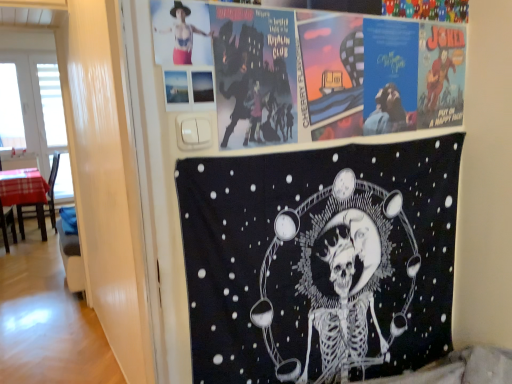
Question: In the image, is matte black and pink fabric at upper left on the left side or the right side of plaid fabric chair at left?

Choices:
 (A) left
 (B) right

Answer: (B)

Question: Is point (190, 1) positioned closer to the camera than point (30, 216)?

Choices:
 (A) closer
 (B) farther

Answer: (A)

Question: Based on their relative distances, which object is farther from the white plastic window screen at left?

Choices:
 (A) black fabric poster at upper center, which ranks as the first poster in bottom-to-top order
 (B) matte paper poster at upper center, positioned as the first poster in top-to-bottom order
 (C) matte black and pink fabric at upper left
 (D) plaid fabric chair at left

Answer: (C)

Question: Which object is the farthest from the white plastic window screen at left?

Choices:
 (A) plaid fabric chair at left
 (B) black fabric poster at upper center, which ranks as the first poster in bottom-to-top order
 (C) matte paper poster at upper center, the second poster when ordered from bottom to top
 (D) matte black and pink fabric at upper left

Answer: (D)